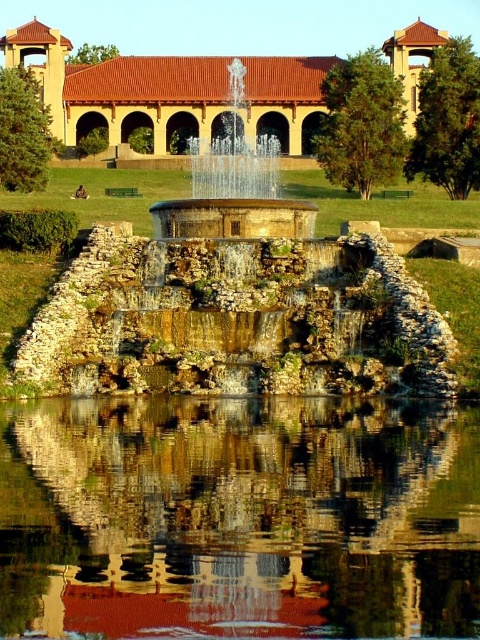
You are standing in the park and want to take a photo of both the beige stone building at center and the shiny metallic fountain at center. If you position yourself to the left of the fountain, will the building be to your right or left in the photo?

The beige stone building at center is to the right of the shiny metallic fountain at center. If you position yourself to the left of the fountain, the building will be to your right in the photo.

You are standing in the park and want to take a photo of the beige stone building at center without the smooth reflective water at center blocking the view. Is there a way to position yourself so that the building is visible without the water in the frame?

The smooth reflective water at center is in front of the beige stone building at center, so to take a photo of the beige stone building at center without the water blocking the view, you would need to position yourself behind the building where the water is not obstructing the view.